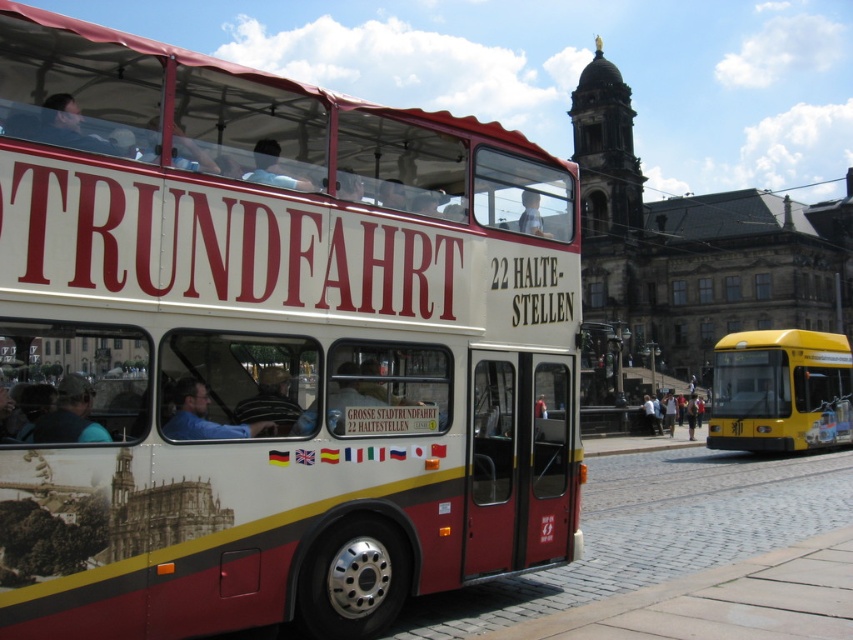
Question: Is matte white bus at center wider than yellow matte bus at lower right?

Choices:
 (A) no
 (B) yes

Answer: (A)

Question: Which of these objects is positioned closest to the blue shirt at driver left?

Choices:
 (A) camouflage fabric cap at left
 (B) yellow plastic bus at center
 (C) matte white bus at center

Answer: (A)

Question: Is yellow matte bus at lower right thinner than blue shirt at driver left?

Choices:
 (A) yes
 (B) no

Answer: (B)

Question: Which object is the closest to the matte white bus at center?

Choices:
 (A) camouflage fabric cap at left
 (B) yellow matte bus at lower right
 (C) yellow plastic bus at center

Answer: (A)

Question: Among these points, which one is nearest to the camera?

Choices:
 (A) (202, 408)
 (B) (788, 420)
 (C) (663, 420)

Answer: (A)

Question: Is yellow matte bus at lower right positioned at the back of blue shirt at driver left?

Choices:
 (A) yes
 (B) no

Answer: (A)